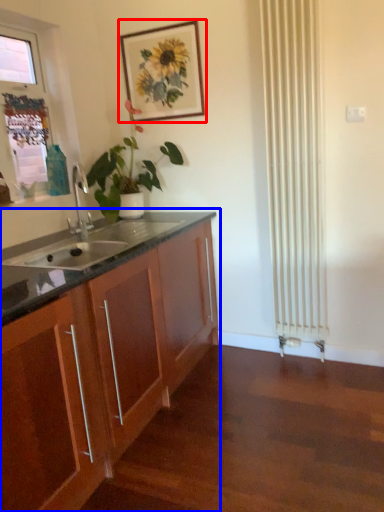
Question: Which object appears farthest to the camera in this image, picture frame (highlighted by a red box) or cabinetry (highlighted by a blue box)?

Choices:
 (A) picture frame
 (B) cabinetry

Answer: (A)